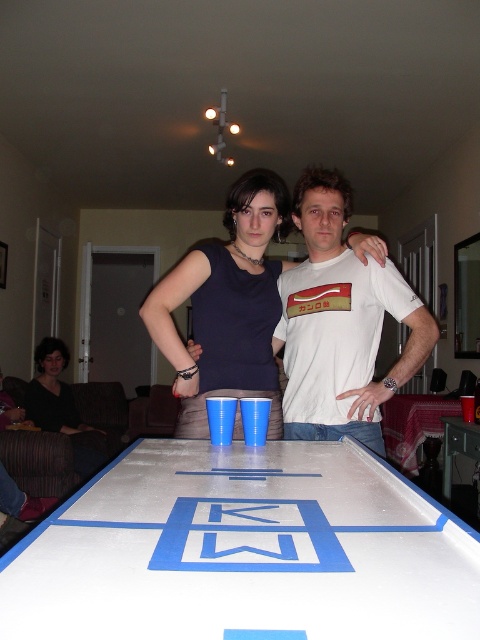
In the scene shown: You are a photographer standing 2 meters away from the camera position. You want to take a photo of the dark brown hair at lower left. Can you capture it in your current position without moving?

The dark brown hair at lower left is 3.16 meters away from the camera. Since you are standing 2 meters away from the camera position, you are 1.16 meters closer to the subject than the camera. However, typical cameras have a minimum focusing distance, usually around 30 cm. As long as you are within the camera lens focusing range, you should be able to capture the dark brown hair at lower left in your current position without moving.

You are standing in the room and want to take a photo of both the dark brown hair at lower left and the white glossy table at center. Which object should you focus on first to ensure both are in the frame?

You should focus on the dark brown hair at lower left first because it is closer to you than the white glossy table at center, ensuring both are in the frame.

You are a delivery person who needs to place a package that is 6 feet long on the floor between the white painted wood table at center and the white glossy table at center. Can the package fit in the space between them?

The distance between the white painted wood table at center and the white glossy table at center is 6.63 feet, so the 6 feet long package can fit in the space between them since it is shorter than the available distance.